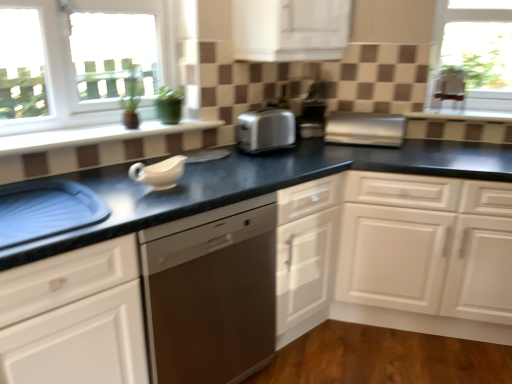
Question: Based on their sizes in the image, would you say white ceramic window sill at upper left is bigger or smaller than black granite countertop at center?

Choices:
 (A) big
 (B) small

Answer: (B)

Question: From the image's perspective, is white ceramic window sill at upper left located above or below black granite countertop at center?

Choices:
 (A) below
 (B) above

Answer: (B)

Question: Which is farther from the white glossy cabinet at upper center, the second cabinetry ordered from the bottom?

Choices:
 (A) blue plastic tray at lower left
 (B) satin silver toaster at center
 (C) white matte cabinet at center, positioned as the first cabinetry in bottom-to-top order
 (D) black granite countertop at center
 (E) stainless steel dishwasher at center

Answer: (A)

Question: Which object is positioned farthest from the white glossy cabinet at upper center, the second cabinetry ordered from the bottom?

Choices:
 (A) satin silver toaster at center
 (B) satin silver toaster at center
 (C) black granite countertop at center
 (D) blue plastic tray at lower left
 (E) stainless steel dishwasher at center

Answer: (D)